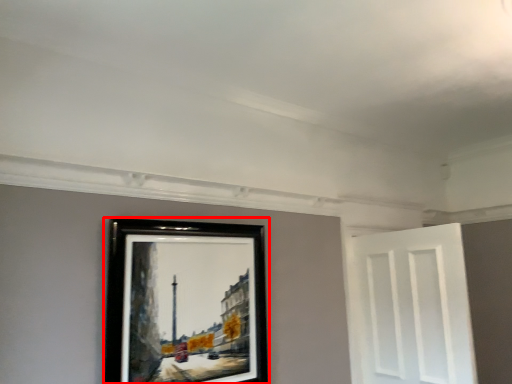
Question: Where is picture frame (annotated by the red box) located in relation to door in the image?

Choices:
 (A) left
 (B) right

Answer: (A)